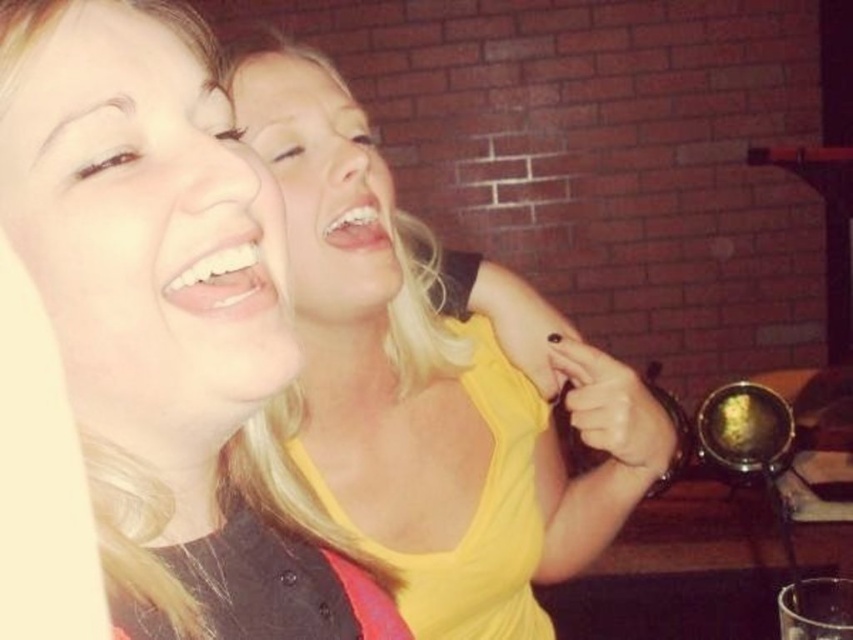
Does yellow matte tank top at upper center have a greater height compared to yellow matte tank top at center?

In fact, yellow matte tank top at upper center may be shorter than yellow matte tank top at center.

Does point (252, 566) come farther from viewer compared to point (451, 337)?

No.

At what (x,y) coordinates should I click in order to perform the action: click on yellow matte tank top at upper center. Please return your answer as a coordinate pair (x, y). This screenshot has height=640, width=853. Looking at the image, I should click on (161, 316).